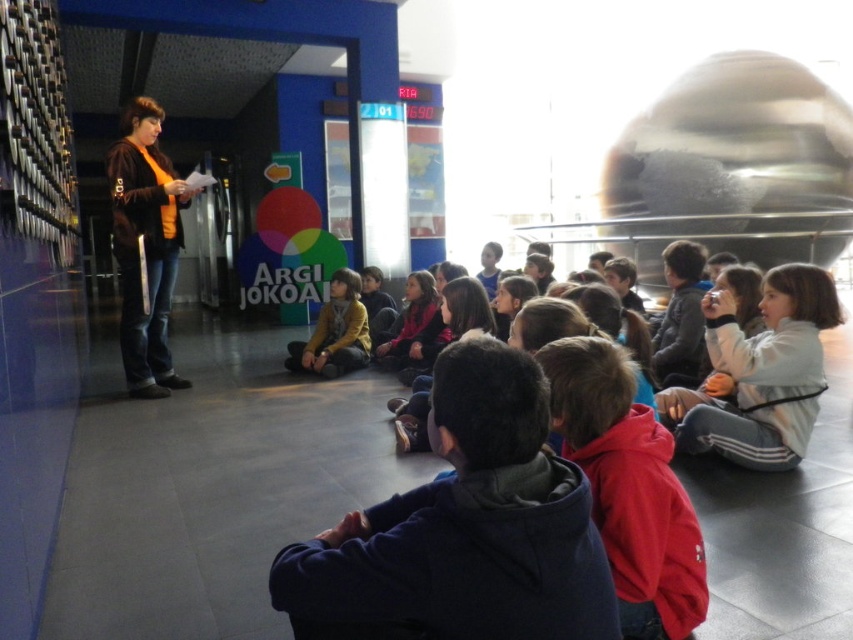
How far apart are red fleece jacket at lower right and orange fleece jacket at left?

A distance of 3.92 meters exists between red fleece jacket at lower right and orange fleece jacket at left.

Where is `red fleece jacket at lower right`? This screenshot has height=640, width=853. red fleece jacket at lower right is located at coordinates (628, 486).

Can you confirm if white fleece jacket at lower right is shorter than matte yellow sweater at center?

Yes.

Which is in front, point (827, 296) or point (341, 292)?

Positioned in front is point (827, 296).

You are a GUI agent. You are given a task and a screenshot of the screen. Output one action in this format:
    pyautogui.click(x=<x>, y=<y>)
    Task: Click on the white fleece jacket at lower right
    The width and height of the screenshot is (853, 640).
    Given the screenshot: What is the action you would take?
    pyautogui.click(x=764, y=372)

Can you confirm if orange fleece jacket at left is positioned to the left of matte yellow sweater at center?

Indeed, orange fleece jacket at left is positioned on the left side of matte yellow sweater at center.

What are the coordinates of `orange fleece jacket at left` in the screenshot? It's located at (144, 246).

Does point (158, 248) lie in front of point (344, 333)?

Yes, point (158, 248) is in front of point (344, 333).

Find the location of a particular element. The height and width of the screenshot is (640, 853). orange fleece jacket at left is located at coordinates (144, 246).